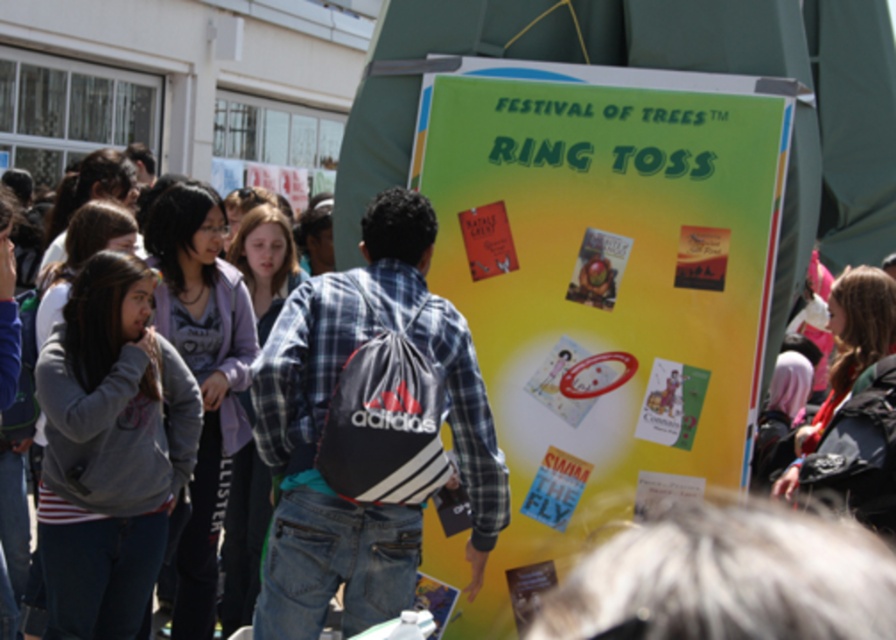
You are at the Festival of Trees and want to read the yellow paper poster at center. You notice a denim jacket at left nearby. Which direction should you move to reach the poster?

The yellow paper poster at center is to the right of the denim jacket at left, so you should move to your right to reach the poster.

You are standing at the center of the Festival of Trees event and see the bright yellow RING TOSS signboard. There is a gray fleece jacket at center. Can you determine if the point at coordinates (201, 378) falls on the gray fleece jacket at center?

Yes, the point at coordinates (201, 378) falls on the gray fleece jacket at center as stated in the description.